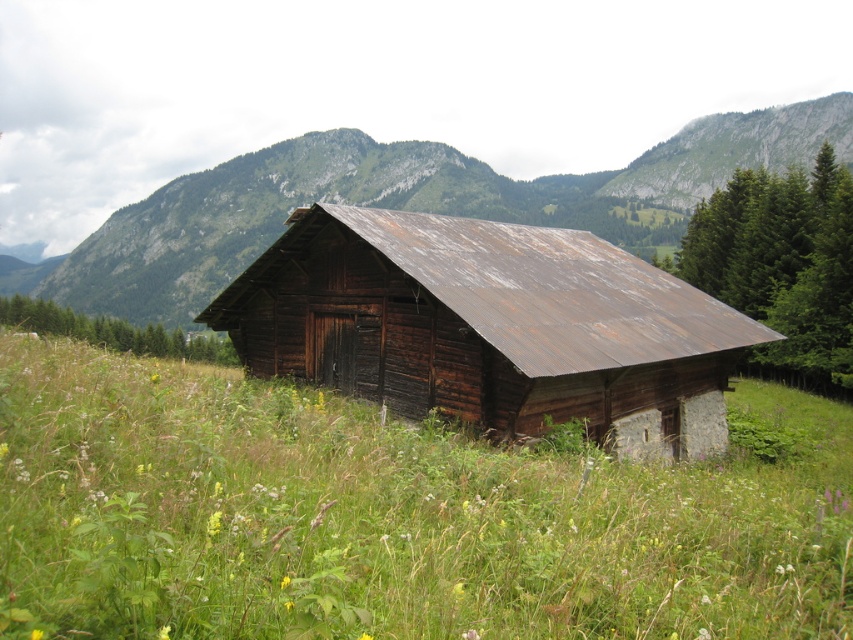
You are standing in the meadow and want to take a photo of the weathered wood barn at center. To ensure the barn is the main focus, where should you position yourself relative to the green grassy at center?

Since the green grassy at center is shorter than the weathered wood barn at center, you should position yourself closer to the green grassy at center to have the barn stand out as the main focus in your photo.

You are standing at the entrance of the rustic wooden barn and want to walk towards the point labeled point (431, 577). Will you pass by the point labeled point (259, 323) before reaching your destination?

Yes, you will pass by the point labeled point (259, 323) before reaching point (431, 577) because point (431, 577) is in front of point (259, 323).

You are a drone operator trying to capture the entire view of the green grassy at center and the weathered wood barn at center in a single shot. Based on the scene, which object should you focus on to ensure both are visible without cropping?

The green grassy at center is larger in size than the weathered wood barn at center, so focusing on the green grassy at center would ensure both are visible in the frame.